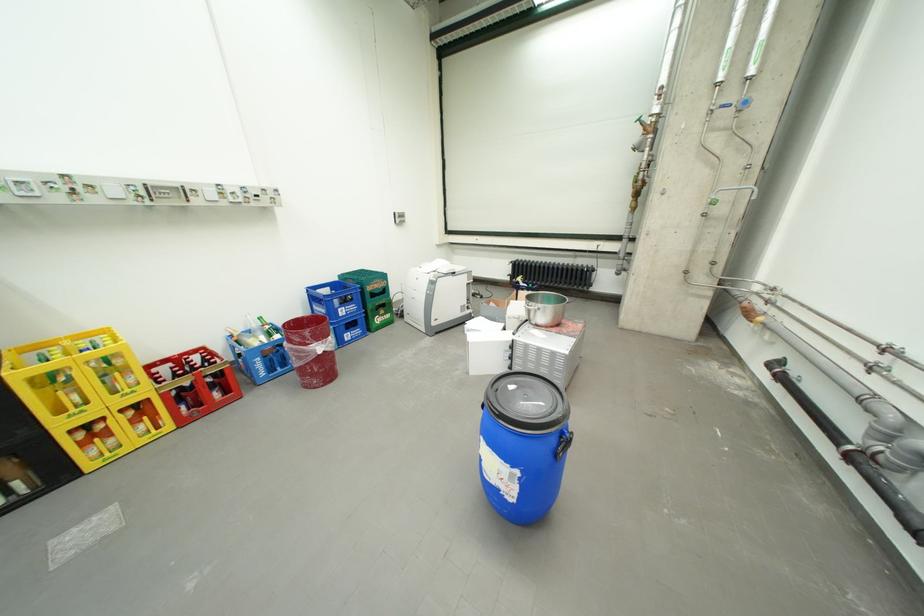
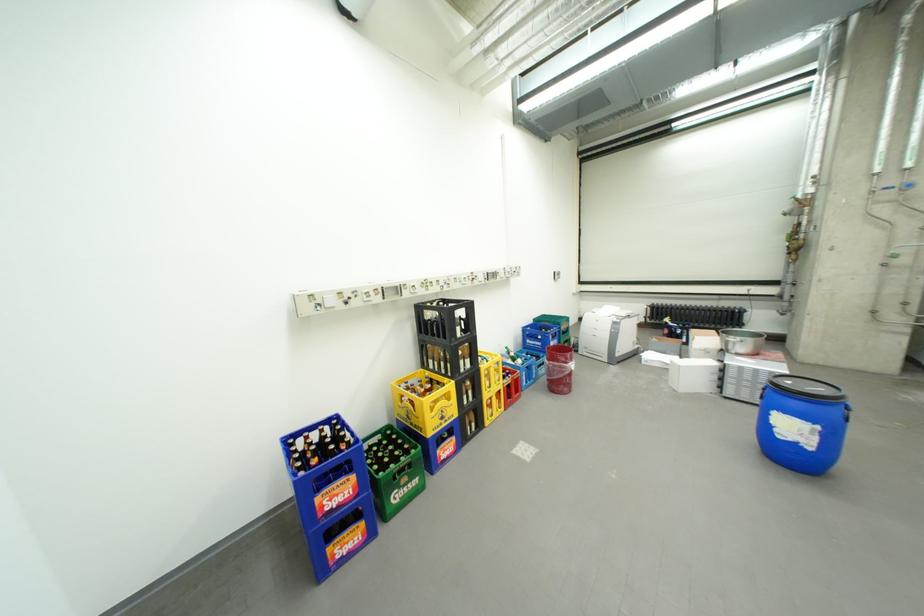
Where in the second image is the point corresponding to point 444,325 from the first image?

(627, 355)